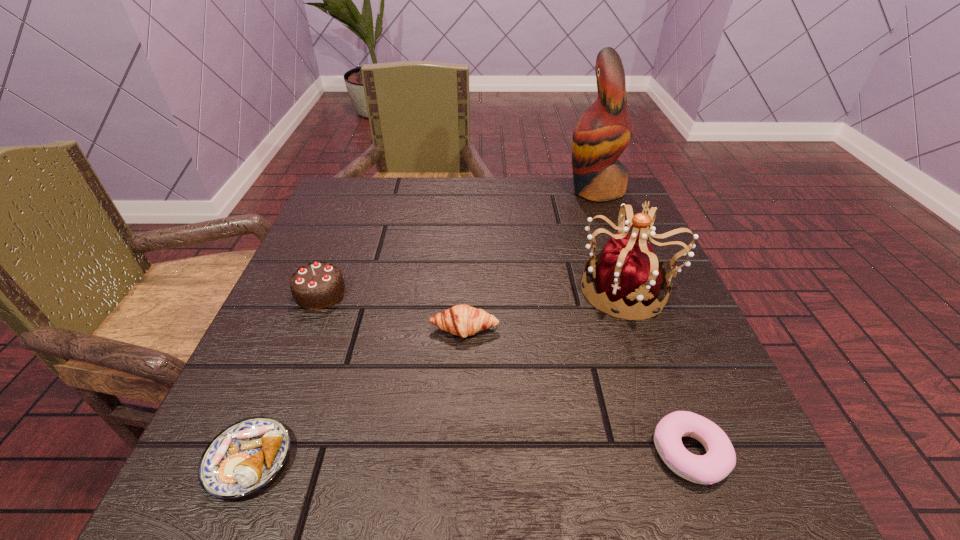
Where is `free space located 0.370m on the face of the farthest object`? This screenshot has height=540, width=960. free space located 0.370m on the face of the farthest object is located at coordinates (418, 190).

Locate an element on the screen. The image size is (960, 540). free space located 0.320m on the front-facing side of the fifth shortest object is located at coordinates (407, 289).

Identify the location of vacant space located on the front-facing side of the fifth shortest object. The width and height of the screenshot is (960, 540). (492, 289).

Identify the location of vacant point located 0.300m on the front-facing side of the fifth shortest object. The height and width of the screenshot is (540, 960). (418, 289).

Locate an element on the screen. free spot located on the right of the fourth shortest object is located at coordinates (398, 293).

Locate an element on the screen. free spot located 0.060m on the front-facing side of the second pastry from right to left is located at coordinates (463, 371).

Find the location of a particular element. This screenshot has width=960, height=540. free space located on the back of the leftmost pastry is located at coordinates (324, 278).

This screenshot has height=540, width=960. Identify the location of free spot located on the left of the rightmost pastry. (593, 454).

Locate an element on the screen. object located in the far edge section of the desktop is located at coordinates (601, 135).

This screenshot has height=540, width=960. Identify the location of chocolate cake that is at the left edge. (317, 285).